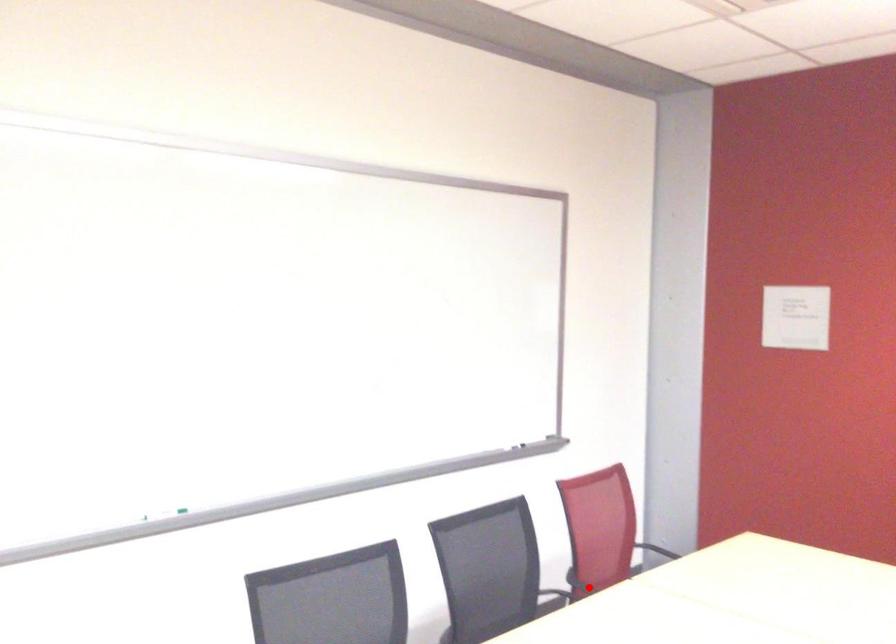
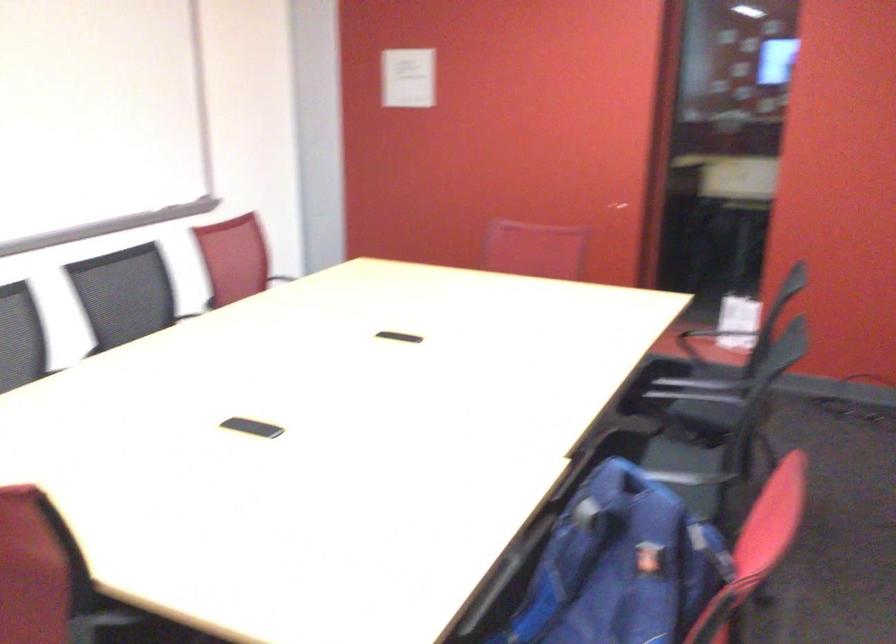
Question: I am providing you with two images of the same scene from different viewpoints. A red point is marked on the first image. Can you still see the location of the red point in image 2?

Choices:
 (A) Yes
 (B) No

Answer: (B)